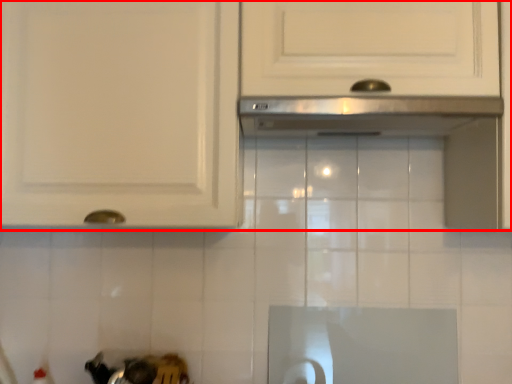
Question: Observing the image, what is the correct spatial positioning of cabinetry (annotated by the red box) in reference to exhaust hood?

Choices:
 (A) left
 (B) right

Answer: (A)